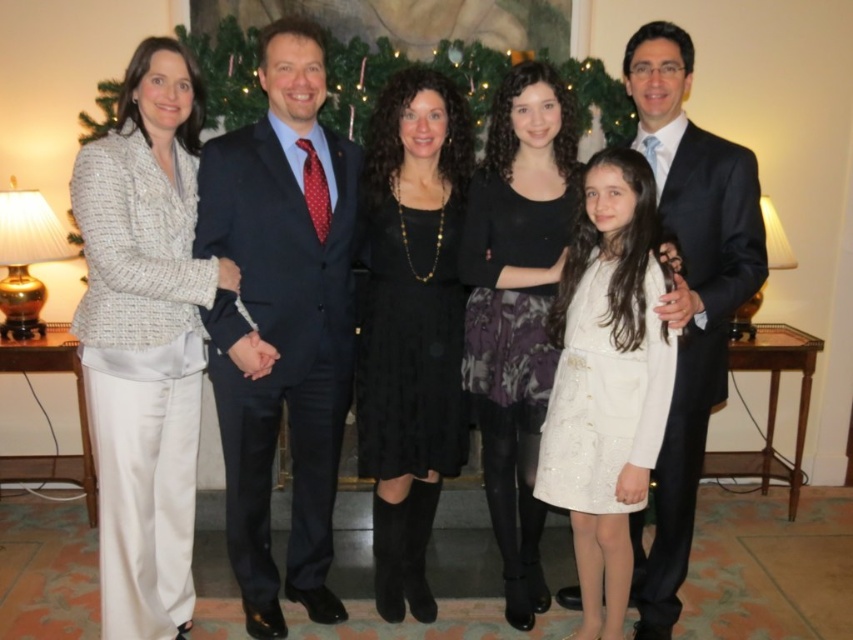
Is point (426, 99) positioned in front of point (614, 282)?

No, it is behind (614, 282).

Between point (419, 195) and point (645, 401), which one is positioned behind?

Point (419, 195)

Locate an element on the screen. This screenshot has height=640, width=853. black suede dress at center is located at coordinates (410, 324).

Is black suede dress at center positioned behind satin black suit at center?

Yes, black suede dress at center is further from the viewer.

Who is more distant from viewer, (368, 461) or (627, 90)?

→ The point (368, 461) is more distant.

I want to click on black suede dress at center, so click(410, 324).

I want to click on black suede dress at center, so click(410, 324).

From the picture: Is dark blue suit at center taller than green textured wreath at center?

Yes, dark blue suit at center is taller than green textured wreath at center.

Which is more to the left, dark blue suit at center or green textured wreath at center?

From the viewer's perspective, dark blue suit at center appears more on the left side.

Is point (251, 454) farther from camera compared to point (601, 120)?

No, it is in front of (601, 120).

The image size is (853, 640). I want to click on dark blue suit at center, so click(x=281, y=321).